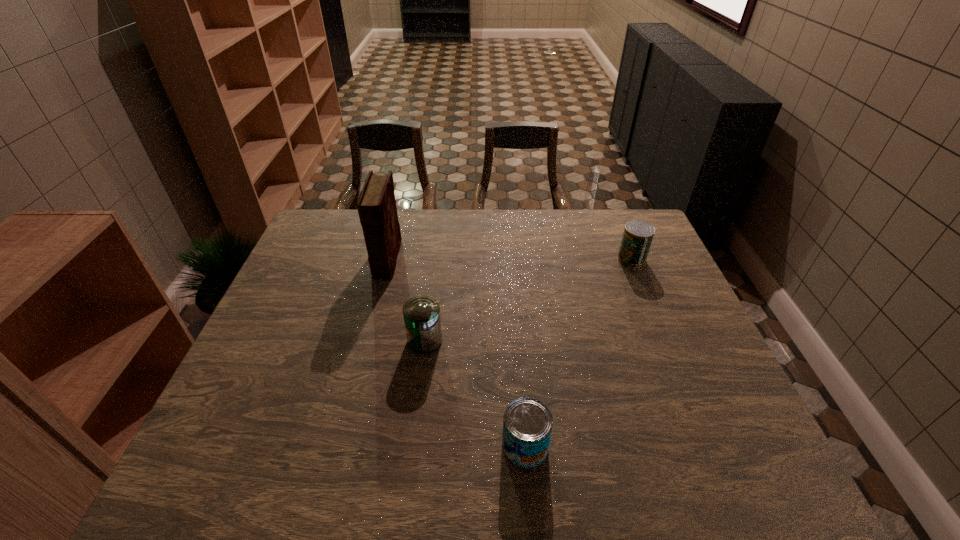
In the image, there is a desktop. Find the location of `free region at the far right corner`. free region at the far right corner is located at coordinates (613, 215).

Find the location of a particular element. The width and height of the screenshot is (960, 540). free point between the shortest can and the third object from right to left is located at coordinates click(475, 393).

Where is `free spot between the third farthest object and the shortest object`? The width and height of the screenshot is (960, 540). free spot between the third farthest object and the shortest object is located at coordinates (475, 393).

I want to click on free area in between the rightmost can and the third object from left to right, so pyautogui.click(x=578, y=352).

At what (x,y) coordinates should I click in order to perform the action: click on free space between the hardback book and the rightmost can. Please return your answer as a coordinate pair (x, y). Looking at the image, I should click on (509, 259).

Image resolution: width=960 pixels, height=540 pixels. I want to click on vacant space that's between the rightmost can and the third farthest object, so click(528, 300).

Find the location of a particular element. free point between the leftmost object and the farthest can is located at coordinates (509, 259).

Identify the location of vacant space that is in between the second object from right to left and the leftmost can. (475, 393).

You are a GUI agent. You are given a task and a screenshot of the screen. Output one action in this format:
    pyautogui.click(x=<x>, y=<y>)
    Task: Click on the free space that is in between the second can from right to left and the leftmost object
    The height and width of the screenshot is (540, 960).
    Given the screenshot: What is the action you would take?
    pyautogui.click(x=456, y=352)

Locate an element on the screen. The height and width of the screenshot is (540, 960). vacant space that's between the rightmost object and the shortest object is located at coordinates (578, 352).